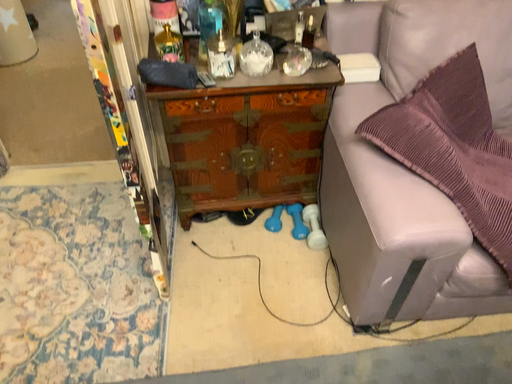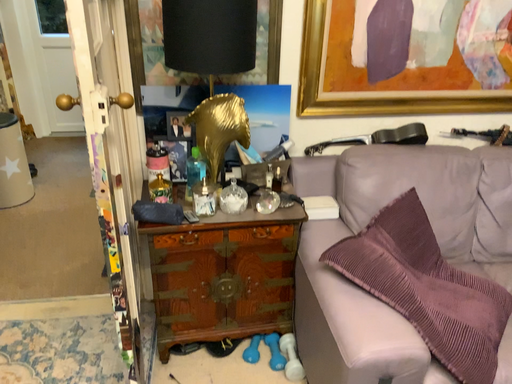
Question: Which way did the camera rotate in the video?

Choices:
 (A) rotated downward
 (B) rotated upward

Answer: (B)